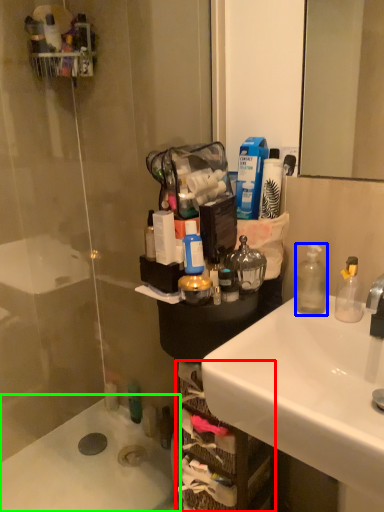
Question: Which is farther away from shelf (highlighted by a red box)? bottle (highlighted by a blue box) or bath (highlighted by a green box)?

Choices:
 (A) bottle
 (B) bath

Answer: (B)